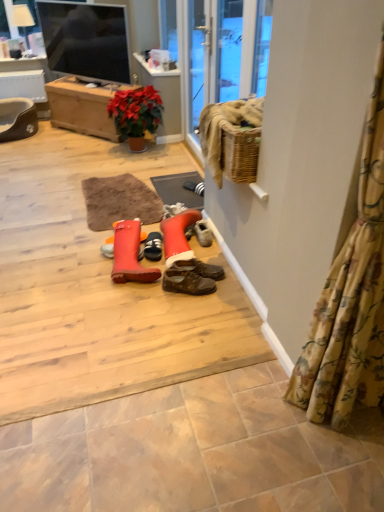
Identify the location of vacant space that is to the left of brown leather shoes at center, the third footwear from the left. Image resolution: width=384 pixels, height=512 pixels. (153, 287).